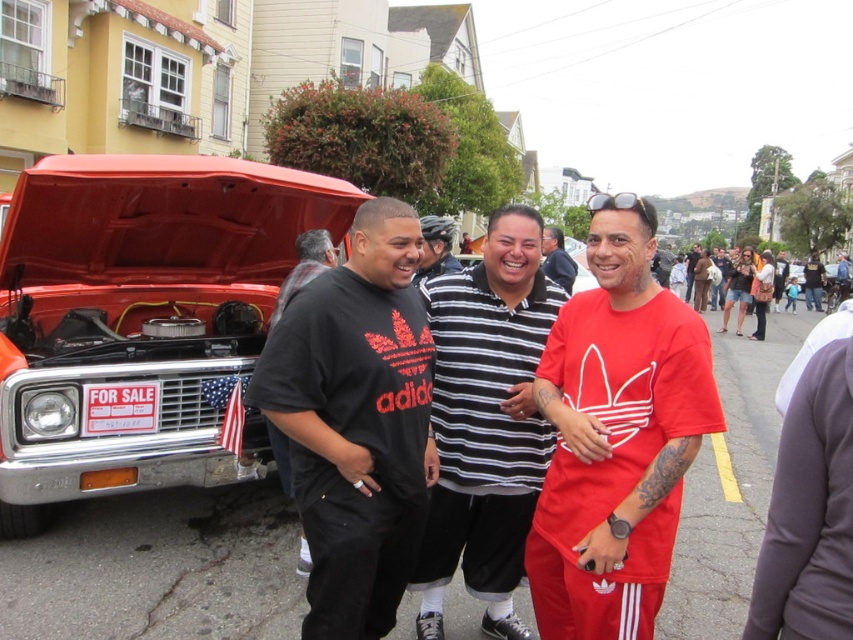
Is black striped shirt at center smaller than red matte shirt at center?

Indeed, black striped shirt at center has a smaller size compared to red matte shirt at center.

Is black striped shirt at center below red matte shirt at center?

Incorrect, black striped shirt at center is not positioned below red matte shirt at center.

Identify the location of black striped shirt at center. This screenshot has width=853, height=640. (434, 248).

Is point (674, 502) positioned in front of point (440, 225)?

Yes, point (674, 502) is closer to viewer.

At what (x,y) coordinates should I click in order to perform the action: click on red matte adidas shirt at center. Please return your answer as a coordinate pair (x, y). This screenshot has width=853, height=640. Looking at the image, I should click on (616, 435).

Between striped cotton shirt at center and dark gray shirt at left, which one appears on the right side from the viewer's perspective?

striped cotton shirt at center is more to the right.

At what (x,y) coordinates should I click in order to perform the action: click on striped cotton shirt at center. Please return your answer as a coordinate pair (x, y). Looking at the image, I should click on (486, 422).